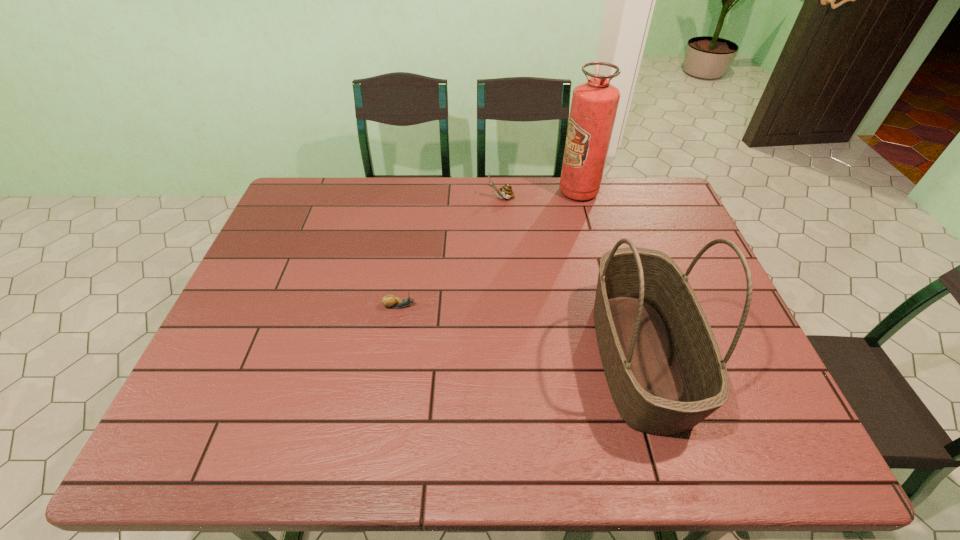
At what (x,y) coordinates should I click in order to perform the action: click on vacant space that satisfies the following two spatial constraints: 1. on the face of the third object from right to left; 2. on the back side of the third shortest object. Please return your answer as a coordinate pair (x, y). Looking at the image, I should click on (510, 356).

You are a GUI agent. You are given a task and a screenshot of the screen. Output one action in this format:
    pyautogui.click(x=<x>, y=<y>)
    Task: Click on the free space that satisfies the following two spatial constraints: 1. on the back side of the second tallest object; 2. on the label side of the tallest object
    Image resolution: width=960 pixels, height=540 pixels.
    Given the screenshot: What is the action you would take?
    pyautogui.click(x=590, y=192)